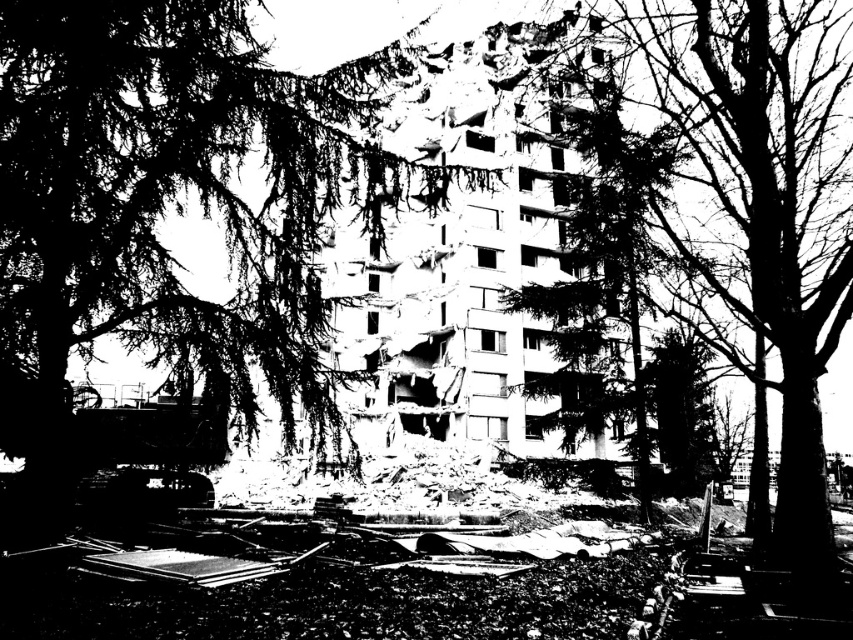
Question: Is dark green textured tree at left closer to the viewer compared to dark green leafy tree at center?

Choices:
 (A) yes
 (B) no

Answer: (A)

Question: Is dark green textured tree at left below dark green leafy tree at center?

Choices:
 (A) yes
 (B) no

Answer: (B)

Question: Which of the following is the closest to the observer?

Choices:
 (A) (12, 330)
 (B) (753, 259)

Answer: (A)

Question: Which object is closer to the camera taking this photo?

Choices:
 (A) dark green leafy tree at center
 (B) dark green textured tree at left

Answer: (B)

Question: Does dark green textured tree at left have a lesser width compared to dark green leafy tree at center?

Choices:
 (A) no
 (B) yes

Answer: (B)